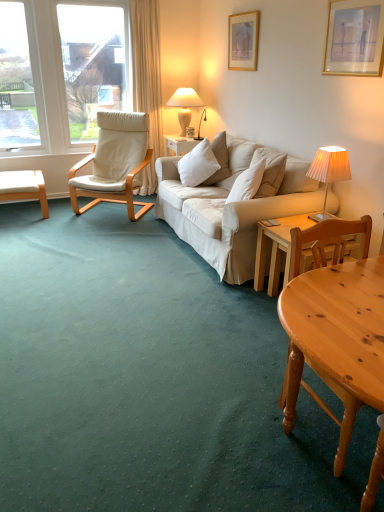
Image resolution: width=384 pixels, height=512 pixels. What are the coordinates of `free spot in front of white leather chair at left` in the screenshot? It's located at (93, 231).